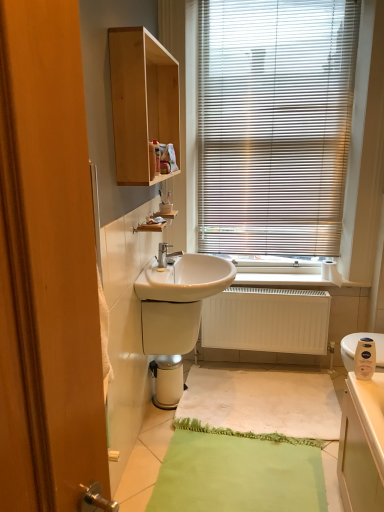
Question: Which is correct: matte plastic soap dispenser at lower right is inside white fabric bath mat at center, or outside of it?

Choices:
 (A) outside
 (B) inside

Answer: (A)

Question: Considering the relative positions of matte plastic soap dispenser at lower right and white fabric bath mat at center in the image provided, is matte plastic soap dispenser at lower right to the left or to the right of white fabric bath mat at center?

Choices:
 (A) left
 (B) right

Answer: (B)

Question: Estimate the real-world distances between objects in this image. Which object is closer to the white glossy sink at center?

Choices:
 (A) wooden cabinet at left
 (B) white matte toilet paper at right
 (C) white glossy water heater at lower center
 (D) white matte radiator at lower center
 (E) metallic blinds at upper right

Answer: (C)

Question: Which object is the farthest from the metallic blinds at upper right?

Choices:
 (A) silver metallic tap at center
 (B) white glossy water heater at lower center
 (C) light wood cabinet at upper center
 (D) white matte radiator at lower center
 (E) wooden cabinet at left

Answer: (E)